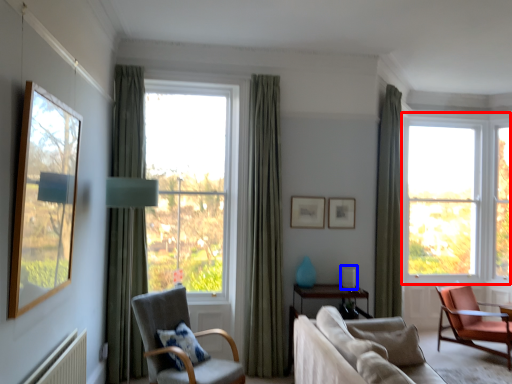
Question: Which object appears farthest to the camera in this image, window (highlighted by a red box) or table lamp (highlighted by a blue box)?

Choices:
 (A) window
 (B) table lamp

Answer: (A)